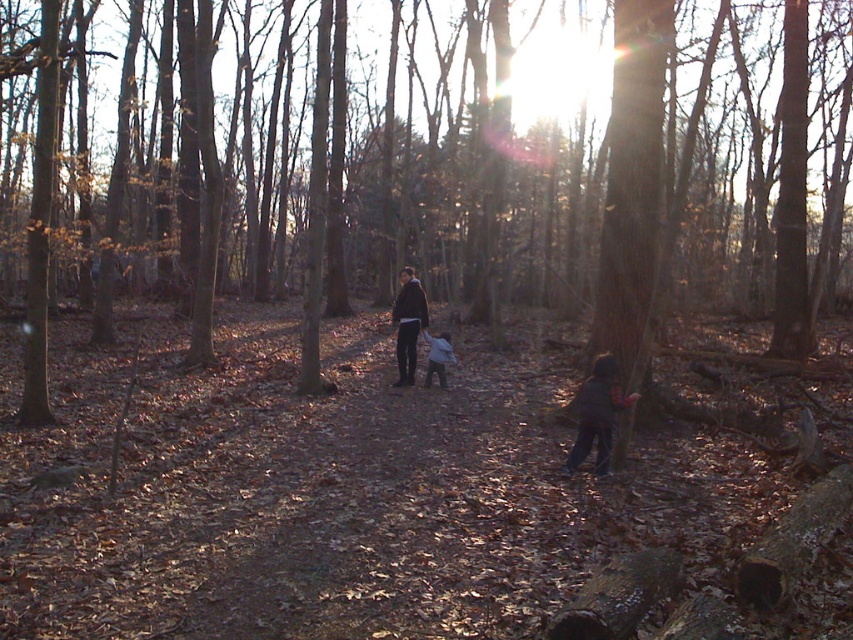
Who is positioned more to the right, dark blue fleece jacket at lower right or dark blue jacket at center?

Positioned to the right is dark blue fleece jacket at lower right.

Can you confirm if dark blue fleece jacket at lower right is shorter than dark blue jacket at center?

In fact, dark blue fleece jacket at lower right may be taller than dark blue jacket at center.

Locate an element on the screen. The height and width of the screenshot is (640, 853). dark blue fleece jacket at lower right is located at coordinates (596, 416).

Who is shorter, dark blue fleece jacket at lower right or light blue fabric at center?

light blue fabric at center is shorter.

Is dark blue fleece jacket at lower right bigger than light blue fabric at center?

Actually, dark blue fleece jacket at lower right might be smaller than light blue fabric at center.

Does point (584, 429) lie behind point (428, 371)?

No.

Identify the location of dark blue fleece jacket at lower right. tap(596, 416).

Describe the element at coordinates (408, 323) in the screenshot. I see `dark blue jacket at center` at that location.

Which of these two, dark blue jacket at center or light blue fabric at center, stands taller?

light blue fabric at center

Locate an element on the screen. The width and height of the screenshot is (853, 640). dark blue jacket at center is located at coordinates (408, 323).

Where is `dark blue jacket at center`? This screenshot has width=853, height=640. dark blue jacket at center is located at coordinates (408, 323).